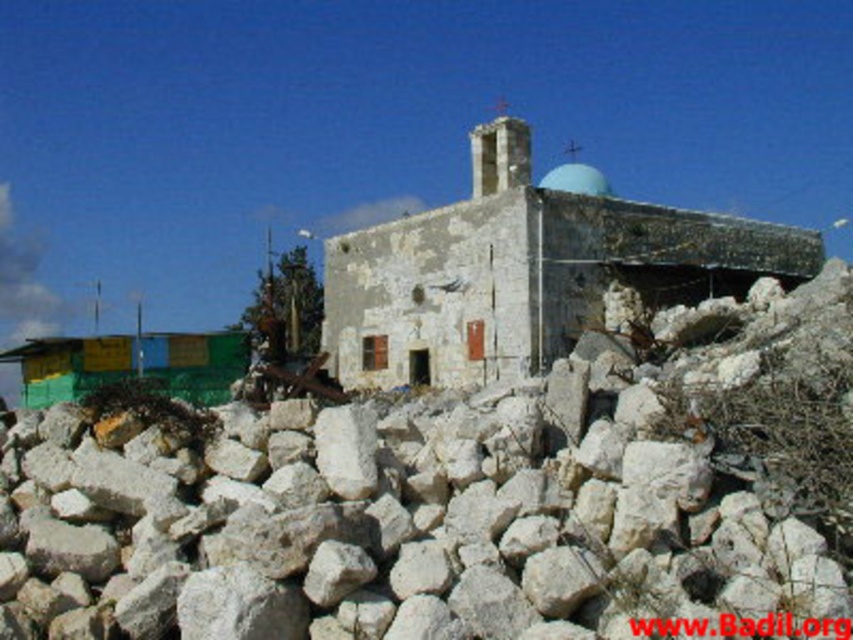
Does white rough rubble at center have a lesser height compared to white stone church at center?

Indeed, white rough rubble at center has a lesser height compared to white stone church at center.

Is white rough rubble at center closer to camera compared to white stone church at center?

Yes.

Image resolution: width=853 pixels, height=640 pixels. What do you see at coordinates (461, 500) in the screenshot? I see `white rough rubble at center` at bounding box center [461, 500].

The height and width of the screenshot is (640, 853). I want to click on white rough rubble at center, so click(461, 500).